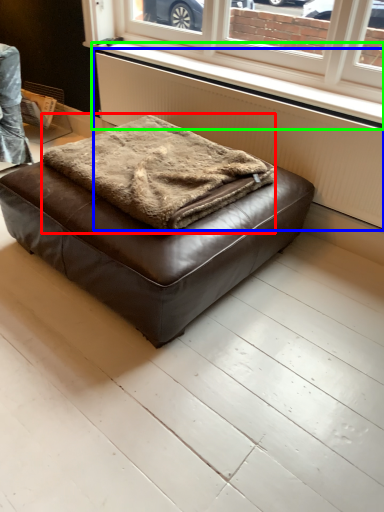
Question: Based on their relative distances, which object is nearer to blanket (highlighted by a red box)? Choose from radiator (highlighted by a blue box) and window sill (highlighted by a green box).

Choices:
 (A) radiator
 (B) window sill

Answer: (A)